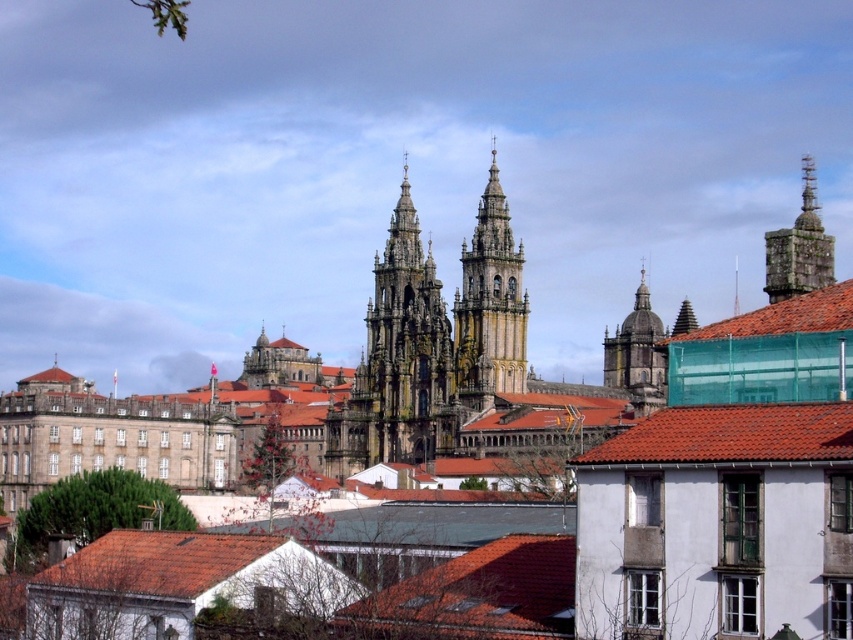
Question: Observing the image, what is the correct spatial positioning of golden stone dome at center in reference to red tile roof at upper center?

Choices:
 (A) below
 (B) above

Answer: (A)

Question: Which point is closer to the camera?

Choices:
 (A) (793, 307)
 (B) (660, 428)
 (C) (155, 570)
 (D) (549, 624)

Answer: (D)

Question: Among these objects, which one is farthest from the camera?

Choices:
 (A) red tile roof at center
 (B) golden stone dome at center
 (C) red tile roof at upper center
 (D) golden stone tower at center

Answer: (D)

Question: Does golden stone dome at center have a smaller size compared to red tile roof at upper center?

Choices:
 (A) yes
 (B) no

Answer: (B)

Question: Does stone gothic cathedral at center have a lesser width compared to brown tile roof at lower left?

Choices:
 (A) yes
 (B) no

Answer: (A)

Question: Which point is closer to the camera?

Choices:
 (A) (142, 586)
 (B) (402, 250)
 (C) (465, 339)

Answer: (A)